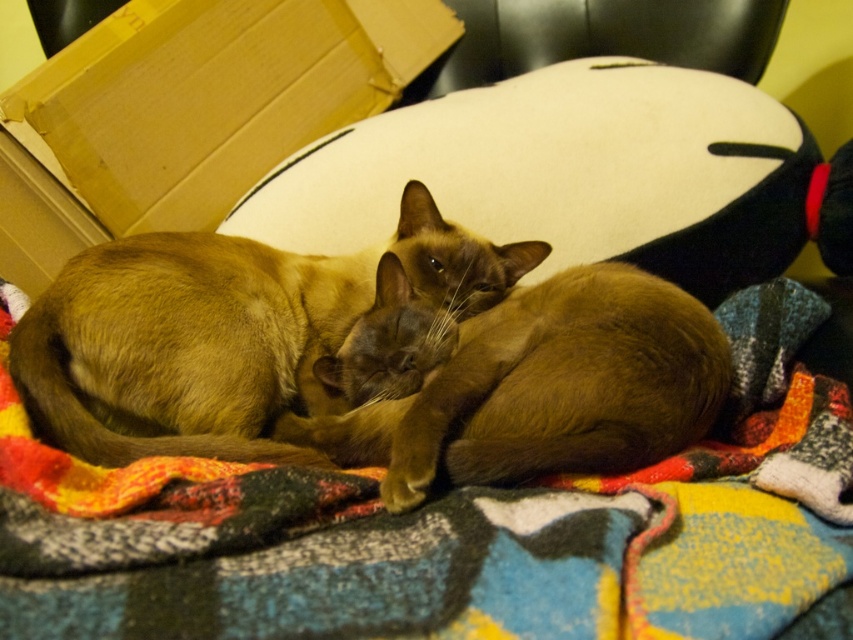
You are a cat owner who wants to place a small toy between the multicolored woven blanket at center and the brown fur cat at center. The toy is 4 inches long. Is there enough space between them to fit the toy?

The multicolored woven blanket at center and brown fur cat at center are 4.49 inches apart. Since the toy is 4 inches long, there is enough space to fit it between them.

You are a cat owner who wants to place a new cat bed on the cardboard box at upper left. However, you also have a black leather chair at upper center nearby. Which object is located lower in the image?

The cardboard box at upper left is located below the black leather chair at upper center, so the cardboard box at upper left is lower in the image.

You are a cat owner who wants to move your cat from the multicolored woven blanket at center to the black leather chair at upper center. Which direction should you move the cat to reach the chair?

The multicolored woven blanket at center is to the left of the black leather chair at upper center, so you should move the cat to the right to reach the chair.